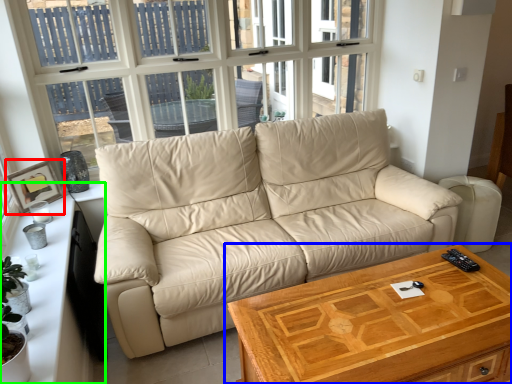
Question: Which is nearer to the picture frame (highlighted by a red box)? table (highlighted by a blue box) or dresser (highlighted by a green box).

Choices:
 (A) table
 (B) dresser

Answer: (B)